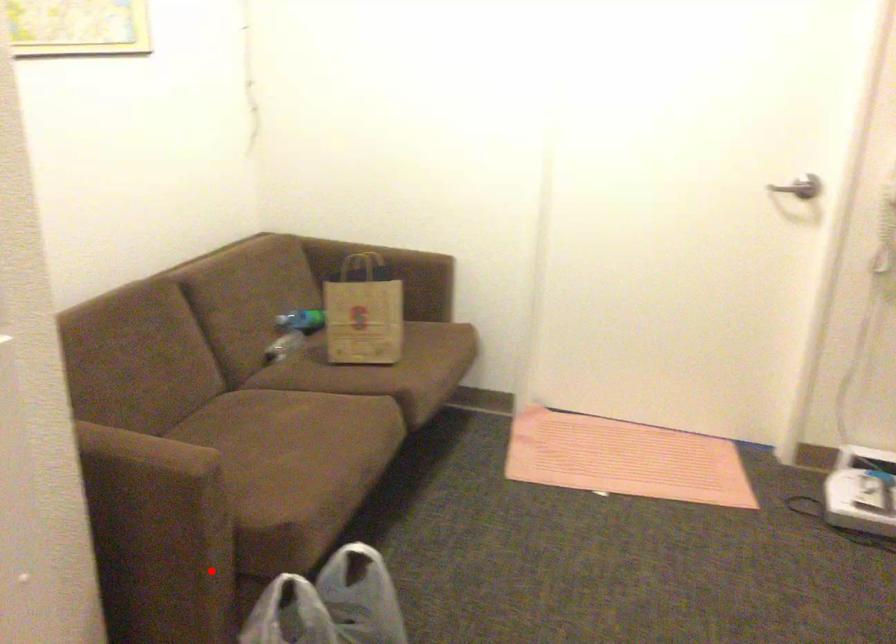
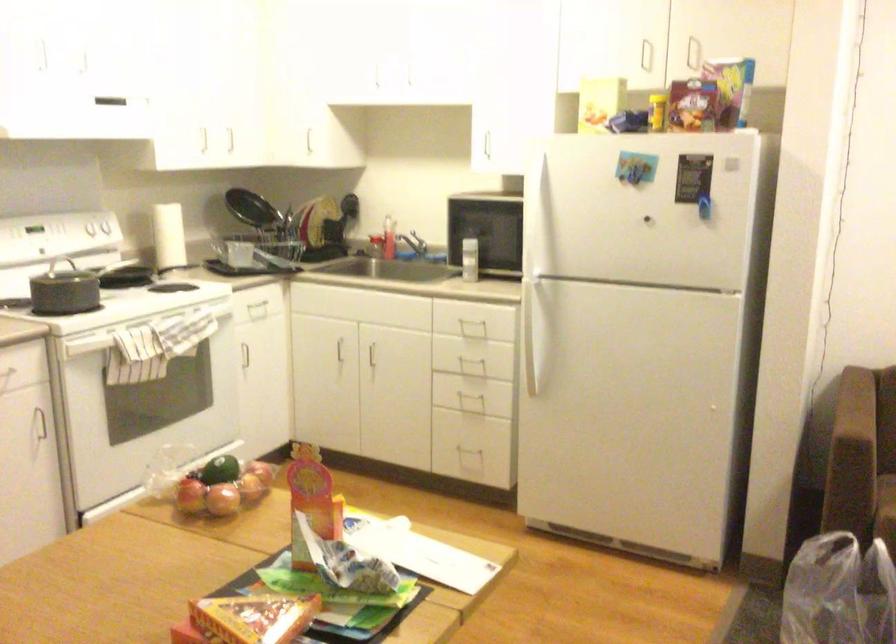
Question: I am providing you with two images of the same scene from different viewpoints. A red point is shown in image1. For the corresponding object point in image2, is it positioned nearer or farther from the camera?

Choices:
 (A) Nearer
 (B) Farther

Answer: (B)